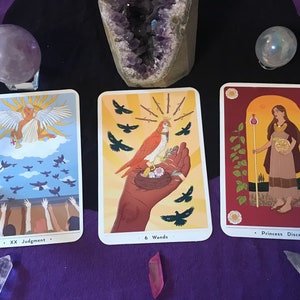
Where is `table cloth`? table cloth is located at coordinates (76, 282).